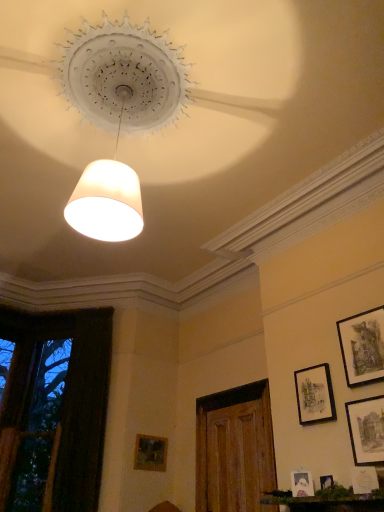
Question: Is point (331, 486) positioned closer to the camera than point (137, 461)?

Choices:
 (A) farther
 (B) closer

Answer: (B)

Question: Relative to wooden picture frame at lower center, which appears as the 7th picture frame when viewed from the front, is matte black picture frame at lower right, positioned as the 3th picture frame in left-to-right order, in front or behind?

Choices:
 (A) behind
 (B) front

Answer: (B)

Question: Considering the real-world distances, which object is farthest from the wooden picture frame at lower center, which ranks as the first picture frame in left-to-right order?

Choices:
 (A) matte black picture frame at lower right, the sixth picture frame positioned from the back
 (B) matte black picture frame at lower right, acting as the fifth picture frame starting from the right
 (C) transparent glass window at left
 (D) wooden door at center
 (E) matte white picture frame at lower right, which is counted as the 1th picture frame, starting from the front

Answer: (A)

Question: Which object is the farthest from the transparent glass window at left?

Choices:
 (A) wooden door at center
 (B) watercolor paper picture frame at upper right, the 7th picture frame when ordered from left to right
 (C) matte black picture frame at lower right, the sixth picture frame positioned from the back
 (D) matte black picture frame at lower right, acting as the sixth picture frame starting from the front
 (E) matte white picture frame at lower right, arranged as the 3th picture frame when viewed from the front

Answer: (C)